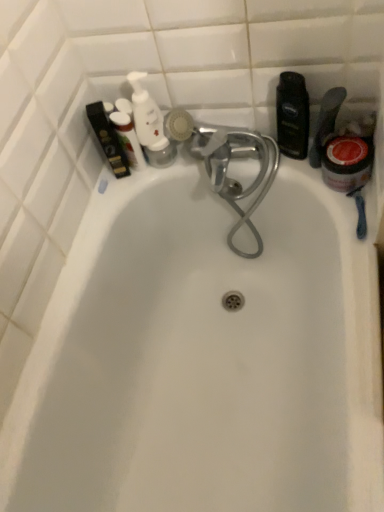
Where is `translucent plastic bottle at right, which ranks as the fifth toiletry in left-to-right order`? This screenshot has width=384, height=512. translucent plastic bottle at right, which ranks as the fifth toiletry in left-to-right order is located at coordinates coord(326,122).

Where is `black matte bottle at upper right, the fourth toiletry positioned from the left`? Image resolution: width=384 pixels, height=512 pixels. black matte bottle at upper right, the fourth toiletry positioned from the left is located at coordinates (292, 115).

What is the approximate width of black matte bottle at upper right, the fourth toiletry positioned from the left?

1.77 inches.

What is the approximate height of white plastic pump bottle at upper left, arranged as the third toiletry when viewed from the left?

white plastic pump bottle at upper left, arranged as the third toiletry when viewed from the left, is 24.68 centimeters tall.

Find the location of `white glossy pump bottle at upper left, which is the second toiletry in left-to-right order`. white glossy pump bottle at upper left, which is the second toiletry in left-to-right order is located at coordinates (128, 139).

Is black matte bottle at upper right, the fourth toiletry positioned from the left, placed right next to translucent plastic bottle at right, which ranks as the fifth toiletry in left-to-right order?

Yes, the surface of black matte bottle at upper right, the fourth toiletry positioned from the left, is in contact with translucent plastic bottle at right, which ranks as the fifth toiletry in left-to-right order.

Who is shorter, black matte bottle at upper right, which ranks as the second toiletry in right-to-left order, or translucent plastic bottle at right, which is counted as the first toiletry, starting from the right?

translucent plastic bottle at right, which is counted as the first toiletry, starting from the right, is shorter.

Which point is more forward, (x=289, y=131) or (x=325, y=122)?

The point (x=289, y=131) is in front.

How distant is black matte bottle at upper right, which ranks as the second toiletry in right-to-left order, from translucent plastic bottle at right, which is counted as the first toiletry, starting from the right?

2.43 inches.

In the scene shown: Is black matte bottle at upper right, the fourth toiletry positioned from the left, completely or partially inside red glossy jar at right?

Actually, black matte bottle at upper right, the fourth toiletry positioned from the left, is outside red glossy jar at right.

Is red glossy jar at right further to camera compared to black matte bottle at upper right, which ranks as the second toiletry in right-to-left order?

Yes, red glossy jar at right is behind black matte bottle at upper right, which ranks as the second toiletry in right-to-left order.

Consider the image. How different are the orientations of red glossy jar at right and black matte bottle at upper right, the fourth toiletry positioned from the left, in degrees?

The angle between the facing direction of red glossy jar at right and the facing direction of black matte bottle at upper right, the fourth toiletry positioned from the left, is 24.3 degrees.

Can you confirm if red glossy jar at right is taller than black matte bottle at upper right, the fourth toiletry positioned from the left?

In fact, red glossy jar at right may be shorter than black matte bottle at upper right, the fourth toiletry positioned from the left.

From a real-world perspective, count 1st toiletrys upward from the translucent plastic bottle at right, which is counted as the first toiletry, starting from the right, and point to it. Please provide its 2D coordinates.

[(292, 115)]

Can you confirm if translucent plastic bottle at right, which is counted as the first toiletry, starting from the right, is positioned to the left of black matte bottle at upper right, which ranks as the second toiletry in right-to-left order?

No.

Considering the sizes of objects translucent plastic bottle at right, which ranks as the fifth toiletry in left-to-right order, and black matte bottle at upper right, the fourth toiletry positioned from the left, in the image provided, who is taller, translucent plastic bottle at right, which ranks as the fifth toiletry in left-to-right order, or black matte bottle at upper right, the fourth toiletry positioned from the left,?

black matte bottle at upper right, the fourth toiletry positioned from the left, is taller.

Is white plastic pump bottle at upper left, arranged as the third toiletry when viewed from the left, situated inside black matte bottle at upper right, the fourth toiletry positioned from the left, or outside?

white plastic pump bottle at upper left, arranged as the third toiletry when viewed from the left, is spatially situated outside black matte bottle at upper right, the fourth toiletry positioned from the left.

From a real-world perspective, which object stands above the other?

white plastic pump bottle at upper left, positioned as the 3th toiletry in right-to-left order, is physically above.

Image resolution: width=384 pixels, height=512 pixels. There is a black matte bottle at upper right, the fourth toiletry positioned from the left. In order to click on the 2nd toiletry above it (from the image's perspective) in this screenshot , I will do `click(150, 125)`.

Considering the positions of objects white plastic pump bottle at upper left, positioned as the 3th toiletry in right-to-left order, and black matte bottle at upper right, which ranks as the second toiletry in right-to-left order, in the image provided, who is behind, white plastic pump bottle at upper left, positioned as the 3th toiletry in right-to-left order, or black matte bottle at upper right, which ranks as the second toiletry in right-to-left order,?

white plastic pump bottle at upper left, positioned as the 3th toiletry in right-to-left order, is behind.

Looking at this image, is red glossy jar at right far from white glossy pump bottle at upper left, which is the second toiletry in left-to-right order?

No, there isn't a large distance between red glossy jar at right and white glossy pump bottle at upper left, which is the second toiletry in left-to-right order.

The width and height of the screenshot is (384, 512). What are the coordinates of `mouthwash on the right of white glossy pump bottle at upper left, the 4th toiletry positioned from the right` in the screenshot? It's located at (347, 163).

Considering the sizes of objects red glossy jar at right and white glossy pump bottle at upper left, which is the second toiletry in left-to-right order, in the image provided, who is shorter, red glossy jar at right or white glossy pump bottle at upper left, which is the second toiletry in left-to-right order,?

Standing shorter between the two is red glossy jar at right.

How many degrees apart are the facing directions of red glossy jar at right and white glossy pump bottle at upper left, which is the second toiletry in left-to-right order?

There is a 0.000971-degree angle between the facing directions of red glossy jar at right and white glossy pump bottle at upper left, which is the second toiletry in left-to-right order.

Is matte black box at upper left, which is the fifth toiletry in right-to-left order, bigger than white plastic pump bottle at upper left, arranged as the third toiletry when viewed from the left?

Correct, matte black box at upper left, which is the fifth toiletry in right-to-left order, is larger in size than white plastic pump bottle at upper left, arranged as the third toiletry when viewed from the left.

From the image's perspective, relative to white plastic pump bottle at upper left, arranged as the third toiletry when viewed from the left, is matte black box at upper left, which is the fifth toiletry in right-to-left order, above or below?

matte black box at upper left, which is the fifth toiletry in right-to-left order, is below white plastic pump bottle at upper left, arranged as the third toiletry when viewed from the left.

Considering the sizes of matte black box at upper left, positioned as the 1th toiletry in left-to-right order, and white plastic pump bottle at upper left, positioned as the 3th toiletry in right-to-left order, in the image, is matte black box at upper left, positioned as the 1th toiletry in left-to-right order, wider or thinner than white plastic pump bottle at upper left, positioned as the 3th toiletry in right-to-left order,?

Considering their sizes, matte black box at upper left, positioned as the 1th toiletry in left-to-right order, looks broader than white plastic pump bottle at upper left, positioned as the 3th toiletry in right-to-left order.

Is point (113, 170) behind point (158, 144)?

Yes, it is behind point (158, 144).

Could you tell me if black matte bottle at upper right, the fourth toiletry positioned from the left, is facing matte black box at upper left, which is the fifth toiletry in right-to-left order?

No, black matte bottle at upper right, the fourth toiletry positioned from the left, is not turned towards matte black box at upper left, which is the fifth toiletry in right-to-left order.

I want to click on the 3rd toiletry counting from the right side of the matte black box at upper left, positioned as the 1th toiletry in left-to-right order, so click(x=292, y=115).

Considering the relative sizes of black matte bottle at upper right, which ranks as the second toiletry in right-to-left order, and matte black box at upper left, which is the fifth toiletry in right-to-left order, in the image provided, is black matte bottle at upper right, which ranks as the second toiletry in right-to-left order, taller than matte black box at upper left, which is the fifth toiletry in right-to-left order,?

Incorrect, the height of black matte bottle at upper right, which ranks as the second toiletry in right-to-left order, is not larger of that of matte black box at upper left, which is the fifth toiletry in right-to-left order.

Is point (300, 100) farther from viewer compared to point (100, 124)?

No, (300, 100) is in front of (100, 124).

Starting from the translucent plastic bottle at right, which is counted as the first toiletry, starting from the right, which toiletry is the 1st one behind? Please provide its 2D coordinates.

[(292, 115)]

The height and width of the screenshot is (512, 384). I want to click on the 2nd toiletry directly above the red glossy jar at right (from a real-world perspective), so click(292, 115).

Based on the photo, estimate the real-world distances between objects in this image. Which object is further from translucent plastic bottle at right, which ranks as the fifth toiletry in left-to-right order, matte black box at upper left, which is the fifth toiletry in right-to-left order, or white glossy pump bottle at upper left, which is the second toiletry in left-to-right order?

matte black box at upper left, which is the fifth toiletry in right-to-left order, is positioned further to the anchor translucent plastic bottle at right, which ranks as the fifth toiletry in left-to-right order.

Based on their spatial positions, is white glossy pump bottle at upper left, which is the second toiletry in left-to-right order, or white plastic pump bottle at upper left, arranged as the third toiletry when viewed from the left, closer to matte black box at upper left, which is the fifth toiletry in right-to-left order?

white glossy pump bottle at upper left, which is the second toiletry in left-to-right order, is closer to matte black box at upper left, which is the fifth toiletry in right-to-left order.

Considering their positions, is black matte bottle at upper right, which ranks as the second toiletry in right-to-left order, positioned closer to white glossy pump bottle at upper left, which is the second toiletry in left-to-right order, than translucent plastic bottle at right, which is counted as the first toiletry, starting from the right?

The object closer to white glossy pump bottle at upper left, which is the second toiletry in left-to-right order, is black matte bottle at upper right, which ranks as the second toiletry in right-to-left order.

Considering their positions, is matte black box at upper left, which is the fifth toiletry in right-to-left order, positioned closer to red glossy jar at right than white plastic pump bottle at upper left, positioned as the 3th toiletry in right-to-left order?

white plastic pump bottle at upper left, positioned as the 3th toiletry in right-to-left order, is closer to red glossy jar at right.

Which object lies nearer to the anchor point black matte bottle at upper right, the fourth toiletry positioned from the left, matte black box at upper left, positioned as the 1th toiletry in left-to-right order, or white plastic pump bottle at upper left, arranged as the third toiletry when viewed from the left?

white plastic pump bottle at upper left, arranged as the third toiletry when viewed from the left.

Which object lies further to the anchor point white glossy pump bottle at upper left, the 4th toiletry positioned from the right, black matte bottle at upper right, the fourth toiletry positioned from the left, or white plastic pump bottle at upper left, positioned as the 3th toiletry in right-to-left order?

black matte bottle at upper right, the fourth toiletry positioned from the left, lies further to white glossy pump bottle at upper left, the 4th toiletry positioned from the right, than the other object.

Considering their positions, is white glossy pump bottle at upper left, the 4th toiletry positioned from the right, positioned closer to white plastic pump bottle at upper left, positioned as the 3th toiletry in right-to-left order, than red glossy jar at right?

white glossy pump bottle at upper left, the 4th toiletry positioned from the right.

Looking at the image, which one is located closer to red glossy jar at right, white plastic pump bottle at upper left, arranged as the third toiletry when viewed from the left, or matte black box at upper left, which is the fifth toiletry in right-to-left order?

The object closer to red glossy jar at right is white plastic pump bottle at upper left, arranged as the third toiletry when viewed from the left.

Identify the location of toiletry between matte black box at upper left, positioned as the 1th toiletry in left-to-right order, and white plastic pump bottle at upper left, positioned as the 3th toiletry in right-to-left order, in the horizontal direction. Image resolution: width=384 pixels, height=512 pixels. (128, 139).

At what (x,y) coordinates should I click in order to perform the action: click on toiletry situated between white glossy pump bottle at upper left, the 4th toiletry positioned from the right, and black matte bottle at upper right, which ranks as the second toiletry in right-to-left order, from left to right. Please return your answer as a coordinate pair (x, y). Looking at the image, I should click on (150, 125).

Find the location of `toiletry situated between black matte bottle at upper right, which ranks as the second toiletry in right-to-left order, and red glossy jar at right from left to right`. toiletry situated between black matte bottle at upper right, which ranks as the second toiletry in right-to-left order, and red glossy jar at right from left to right is located at coordinates (326, 122).

Where is `toiletry between white plastic pump bottle at upper left, arranged as the third toiletry when viewed from the left, and translucent plastic bottle at right, which ranks as the fifth toiletry in left-to-right order, in the horizontal direction`? toiletry between white plastic pump bottle at upper left, arranged as the third toiletry when viewed from the left, and translucent plastic bottle at right, which ranks as the fifth toiletry in left-to-right order, in the horizontal direction is located at coordinates (292, 115).